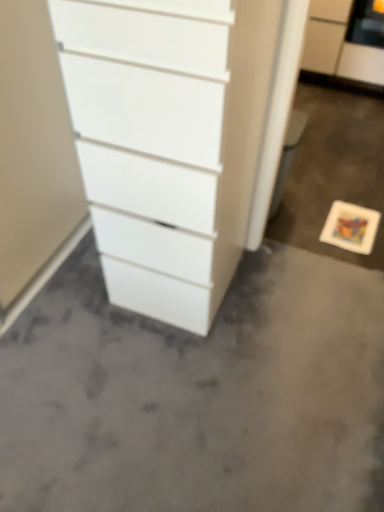
Locate an element on the screen. vacant space to the right of white glossy chest of drawers at center is located at coordinates (284, 302).